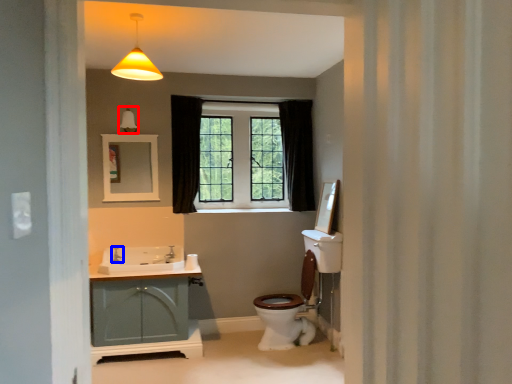
Question: Among these objects, which one is farthest to the camera, light fixture (highlighted by a red box) or faucet (highlighted by a blue box)?

Choices:
 (A) light fixture
 (B) faucet

Answer: (B)